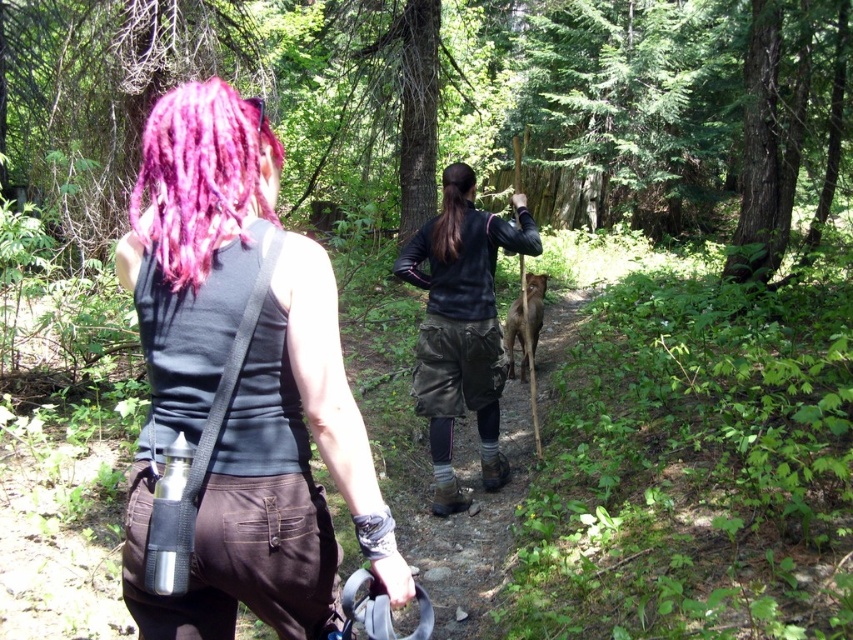
You are a hiker who just arrived at the forest and see the person with the matte black tank top at upper left. You want to catch up to them. Can you estimate how far you need to walk to reach them?

The distance between you and the person with the matte black tank top at upper left is 4.59 feet, so you can easily walk that distance to catch up to them.

Based on the photo, you are hiking along the forest path and want to place a marker at point (143, 132) and another at point (459, 198). Which marker will be closer to your current position?

The marker at point (143, 132) will be closer to your current position because it is further to the camera than point (459, 198), meaning it is physically nearer to you.